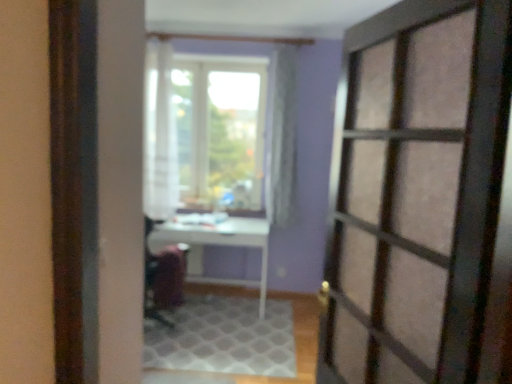
Question: In terms of size, does matte glass door at right appear bigger or smaller than white textured rug at center?

Choices:
 (A) small
 (B) big

Answer: (B)

Question: From their relative heights in the image, would you say matte glass door at right is taller or shorter than white textured rug at center?

Choices:
 (A) short
 (B) tall

Answer: (B)

Question: Considering the real-world distances, which object is farthest from the white sheer curtain at center?

Choices:
 (A) white glossy table at center
 (B) white textured rug at center
 (C) velvet-like burgundy armchair at center
 (D) matte glass door at right

Answer: (D)

Question: Which object is positioned closest to the white glossy table at center?

Choices:
 (A) white sheer curtain at center
 (B) matte glass door at right
 (C) velvet-like burgundy armchair at center
 (D) white textured rug at center

Answer: (C)